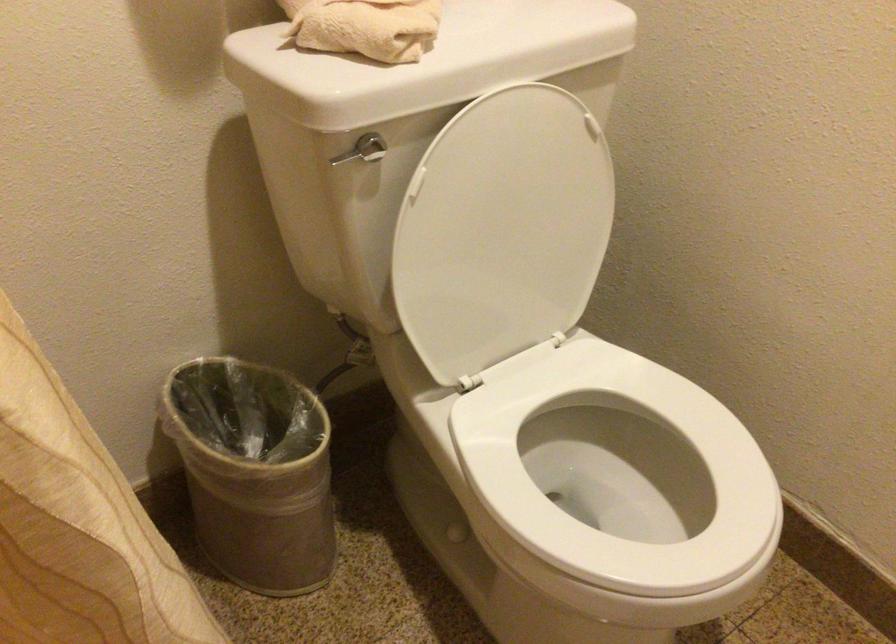
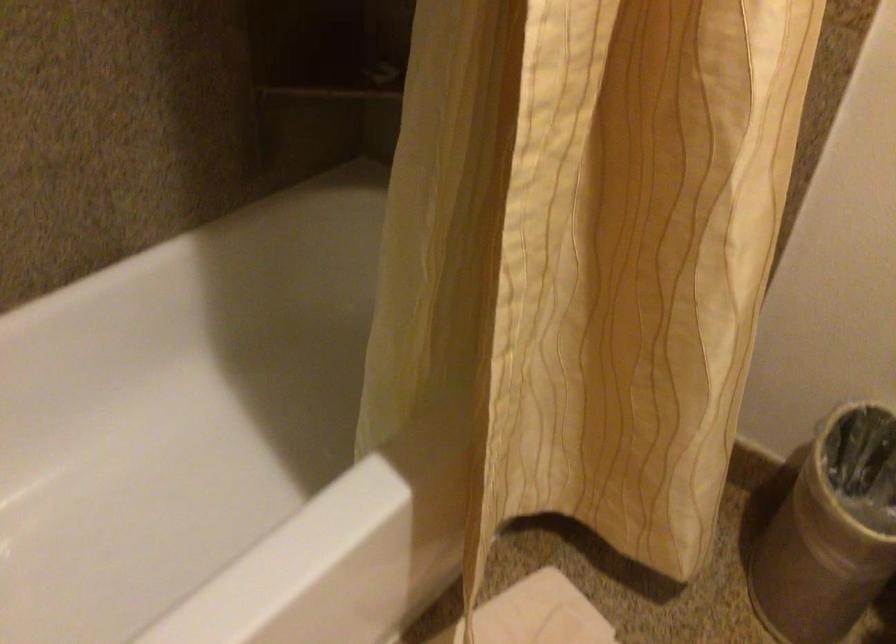
In the scene shown: Based on the continuous images, in which direction is the camera rotating?

The camera's rotation is toward left-down.